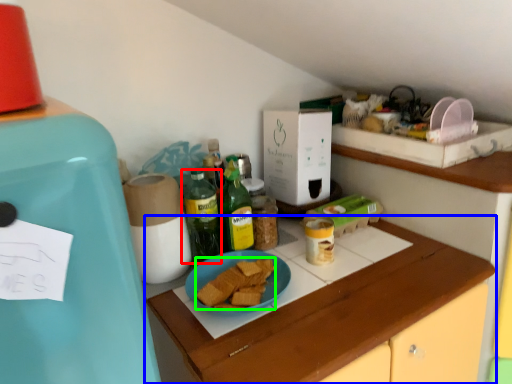
Question: Which object is positioned closest to bottle (highlighted by a red box)? Select from cabinetry (highlighted by a blue box) and food (highlighted by a green box).

Choices:
 (A) cabinetry
 (B) food

Answer: (B)